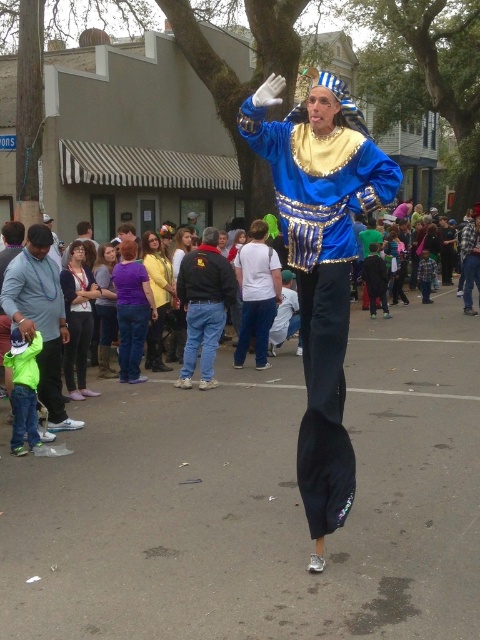
Question: Is blue satin costume at center bigger than green matte jacket at lower left?

Choices:
 (A) yes
 (B) no

Answer: (A)

Question: Observing the image, what is the correct spatial positioning of green matte jacket at lower left in reference to purple cotton shirt at center?

Choices:
 (A) right
 (B) left

Answer: (B)

Question: Does purple cotton shirt at center appear on the right side of purple fabric shirt at center?

Choices:
 (A) no
 (B) yes

Answer: (B)

Question: Among these points, which one is farthest from the camera?

Choices:
 (A) (69, 268)
 (B) (13, 298)
 (C) (358, 179)

Answer: (A)

Question: Which point appears farthest from the camera in this image?

Choices:
 (A) (49, 260)
 (B) (180, 252)
 (C) (164, 262)

Answer: (B)

Question: Which object is the farthest from the purple cotton shirt at center?

Choices:
 (A) blue satin costume at center
 (B) yellow shirt at center
 (C) black denim jacket at center
 (D) yellow fabric shirt at center

Answer: (A)